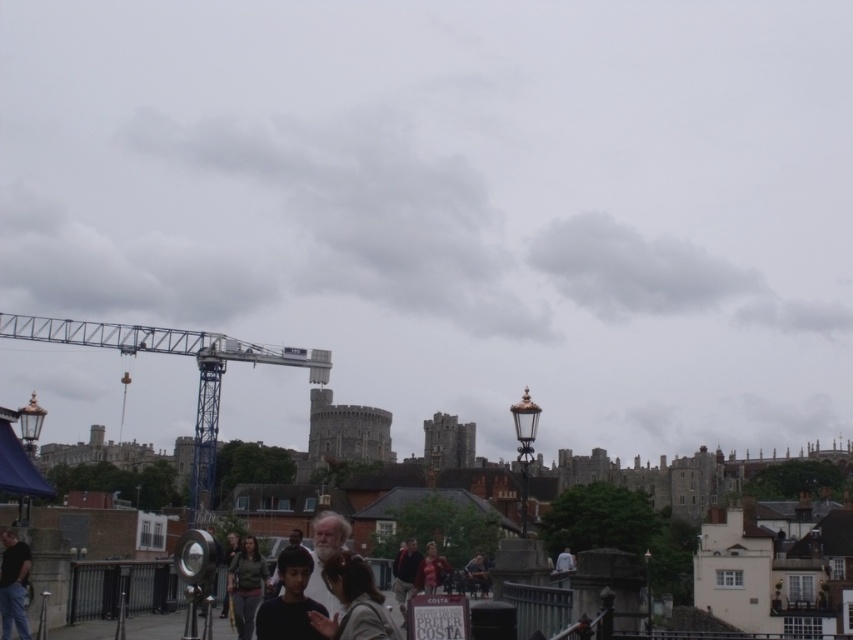
Question: Is blue metallic crane at upper left below dark gray shirt at lower left?

Choices:
 (A) no
 (B) yes

Answer: (B)

Question: Estimate the real-world distances between objects in this image. Which object is farther from the blue metallic crane at upper left?

Choices:
 (A) light brown leather jacket at center
 (B) matte red dress at center
 (C) smooth black shirt at center
 (D) dark gray shirt at lower left

Answer: (C)

Question: Does light brown hair at center appear under smooth black shirt at center?

Choices:
 (A) yes
 (B) no

Answer: (B)

Question: Is metallic amusement park ride at center to the right of blue metallic crane at upper left from the viewer's perspective?

Choices:
 (A) no
 (B) yes

Answer: (B)

Question: Estimate the real-world distances between objects in this image. Which object is closer to the matte red dress at center?

Choices:
 (A) dark blue jacket at center
 (B) blue metallic crane at upper left
 (C) green fabric jacket at lower center

Answer: (A)

Question: Which is nearer to the light brown hair at center?

Choices:
 (A) dark gray shirt at lower left
 (B) metallic amusement park ride at center
 (C) blue metallic crane at upper left

Answer: (A)